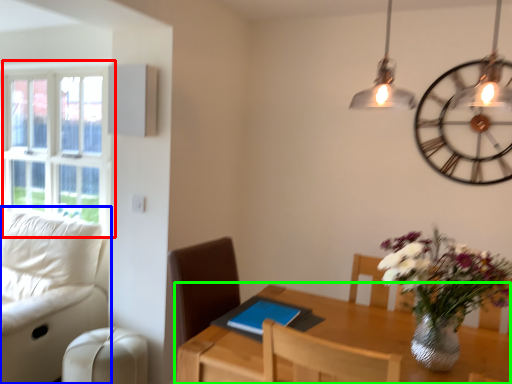
Question: Which is nearer to the window (highlighted by a red box)? studio couch (highlighted by a blue box) or table (highlighted by a green box).

Choices:
 (A) studio couch
 (B) table

Answer: (A)